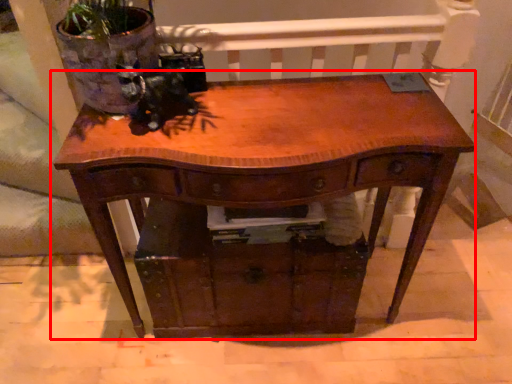
Question: From the image, what is the correct spatial relationship of table (annotated by the red box) in relation to drawer?

Choices:
 (A) right
 (B) left

Answer: (A)